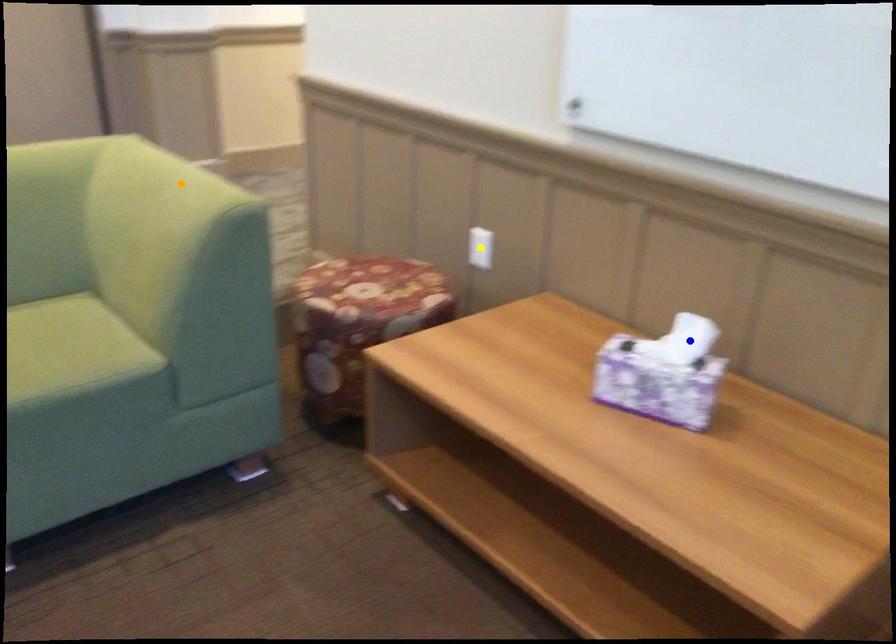
Order these from farthest to nearest:
- blue point
- yellow point
- orange point

yellow point
orange point
blue point